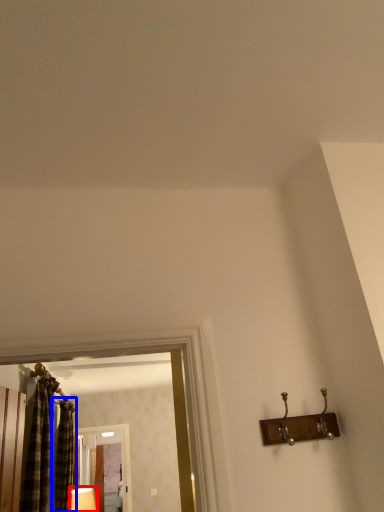
Question: Which of the following is the farthest to the observer, lamp (highlighted by a red box) or shower curtain (highlighted by a blue box)?

Choices:
 (A) lamp
 (B) shower curtain

Answer: (A)